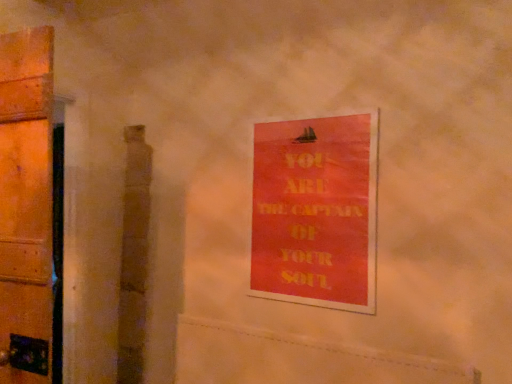
The height and width of the screenshot is (384, 512). What do you see at coordinates (316, 212) in the screenshot? I see `matte red poster at center` at bounding box center [316, 212].

Where is `matte red poster at center`? This screenshot has width=512, height=384. matte red poster at center is located at coordinates (316, 212).

Where is `matte red poster at center`? matte red poster at center is located at coordinates (316, 212).